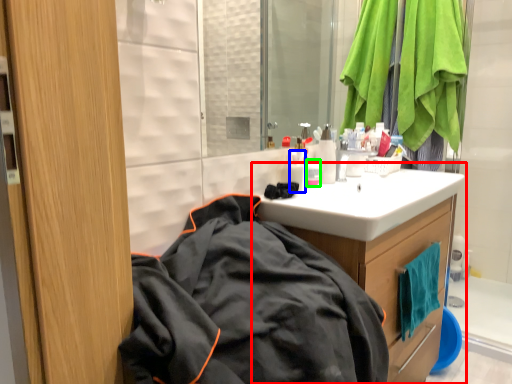
Question: Based on their relative distances, which object is nearer to bathroom cabinet (highlighted by a red box)? Choose from toiletry (highlighted by a blue box) and toiletry (highlighted by a green box).

Choices:
 (A) toiletry
 (B) toiletry

Answer: (B)